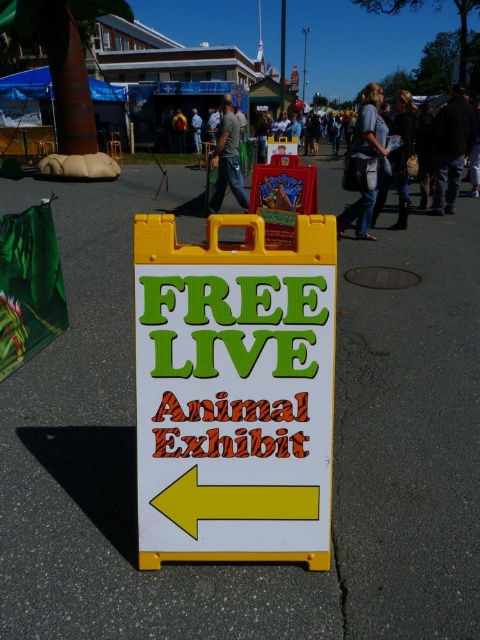
Question: Is dark gray shirt at center bigger than matte green shirt at center?

Choices:
 (A) yes
 (B) no

Answer: (A)

Question: Which of the following is the closest to the observer?

Choices:
 (A) dark blue shirt at center
 (B) matte yellow sign at center
 (C) dark gray shirt at center
 (D) white plastic sign at center

Answer: (D)

Question: Considering the relative positions of matte yellow sign at center and matte green shirt at center in the image provided, where is matte yellow sign at center located with respect to matte green shirt at center?

Choices:
 (A) left
 (B) right

Answer: (B)

Question: Estimate the real-world distances between objects in this image. Which object is farther from the matte yellow sign at center?

Choices:
 (A) matte green shirt at center
 (B) white plastic sign at center
 (C) dark blue jeans at center

Answer: (C)

Question: Which point is closer to the camera taking this photo?

Choices:
 (A) (181, 145)
 (B) (194, 131)

Answer: (A)

Question: Does denim jacket at upper center have a smaller size compared to matte green shirt at center?

Choices:
 (A) yes
 (B) no

Answer: (B)